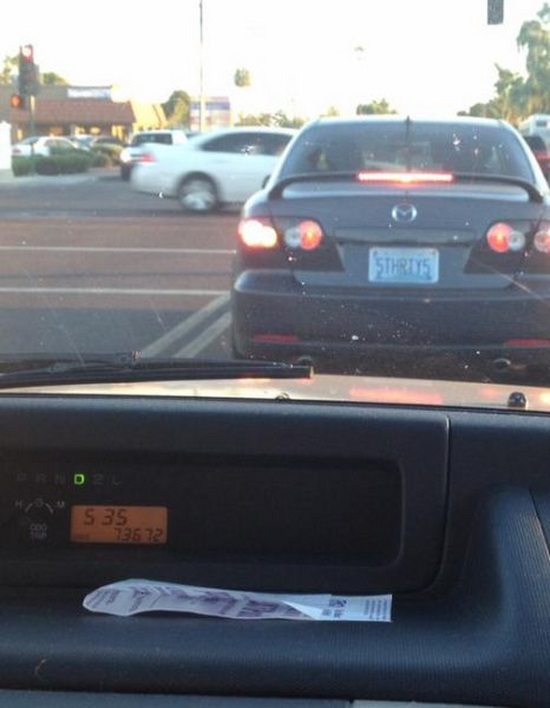
The image size is (550, 708). What are the coordinates of `clock` in the screenshot? It's located at (115, 513).